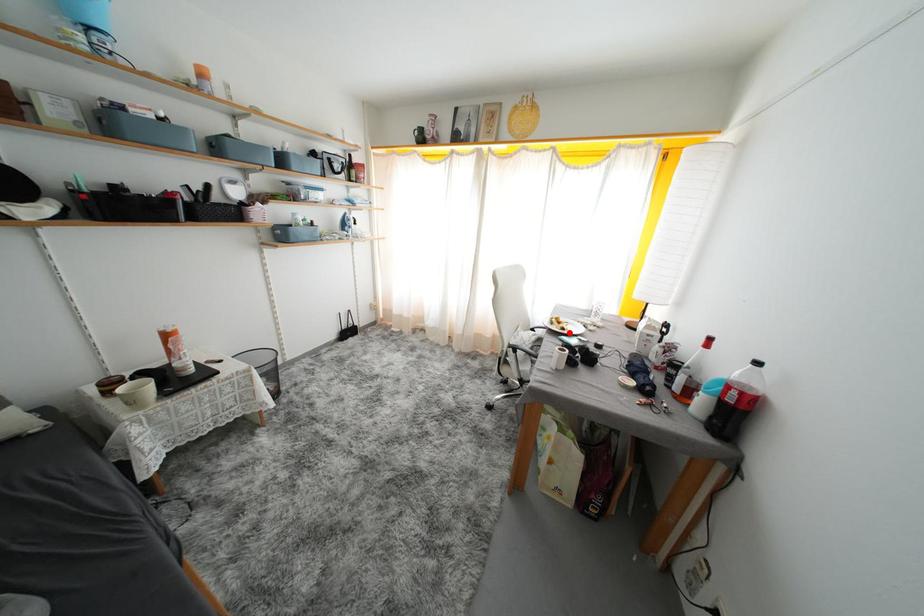
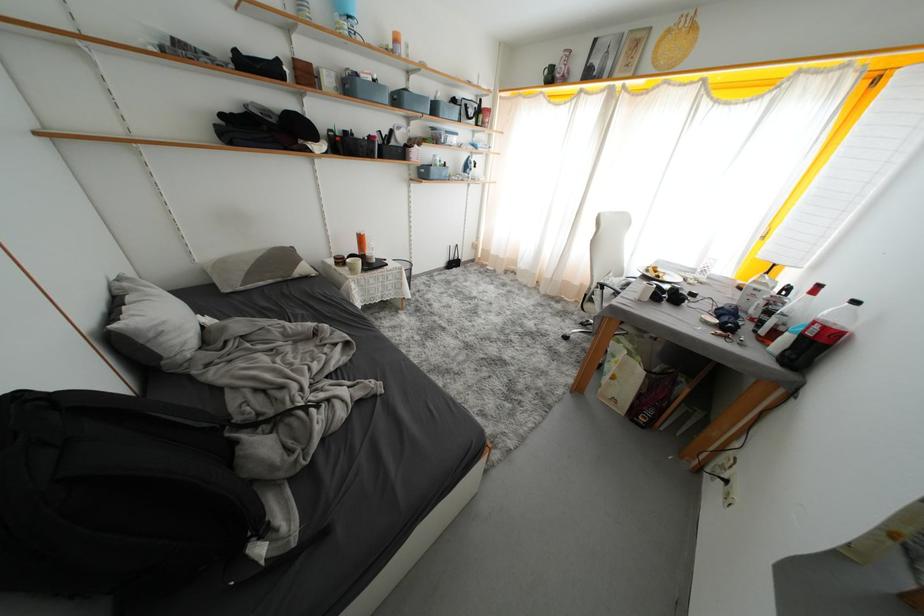
Question: I am providing you with two images of the same scene from different viewpoints. Image1 has a red point marked. In image2, the corresponding 3D location appears at what relative position? Reply with the corresponding letter.

Choices:
 (A) Closer
 (B) Farther

Answer: (A)